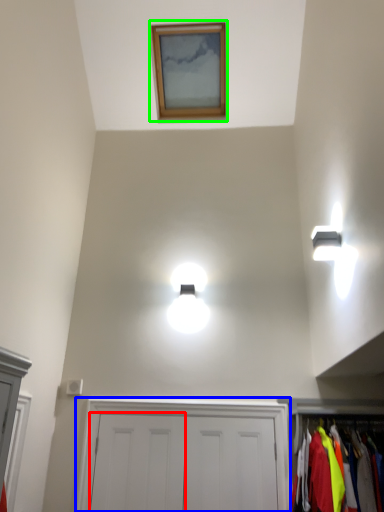
Question: Considering the real-world distances, which object is farthest from door (highlighted by a red box)? dresser (highlighted by a blue box) or picture frame (highlighted by a green box)?

Choices:
 (A) dresser
 (B) picture frame

Answer: (B)